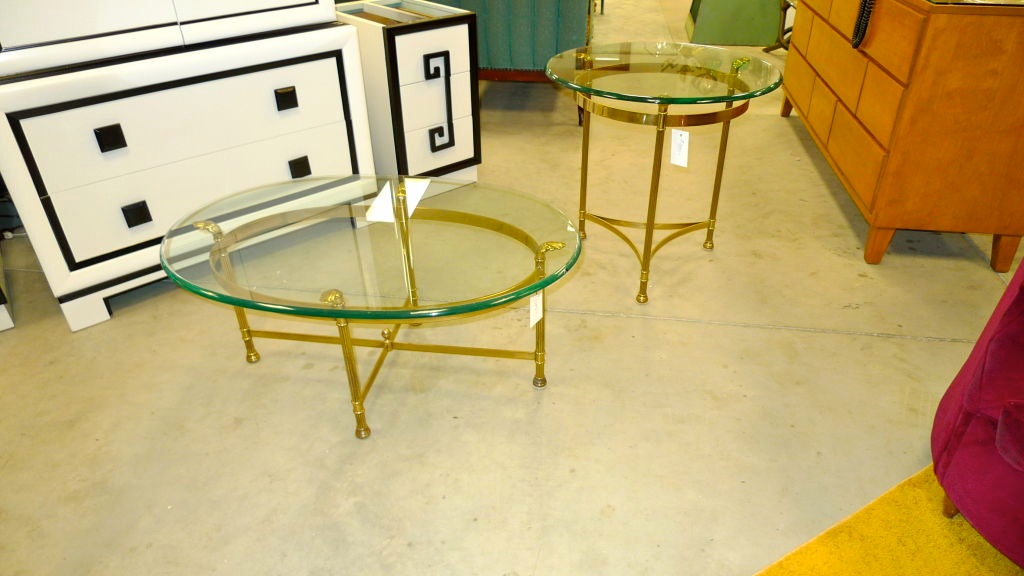
In order to click on square knobs in this screenshot , I will do `click(114, 136)`, `click(289, 100)`, `click(136, 217)`, `click(296, 166)`.